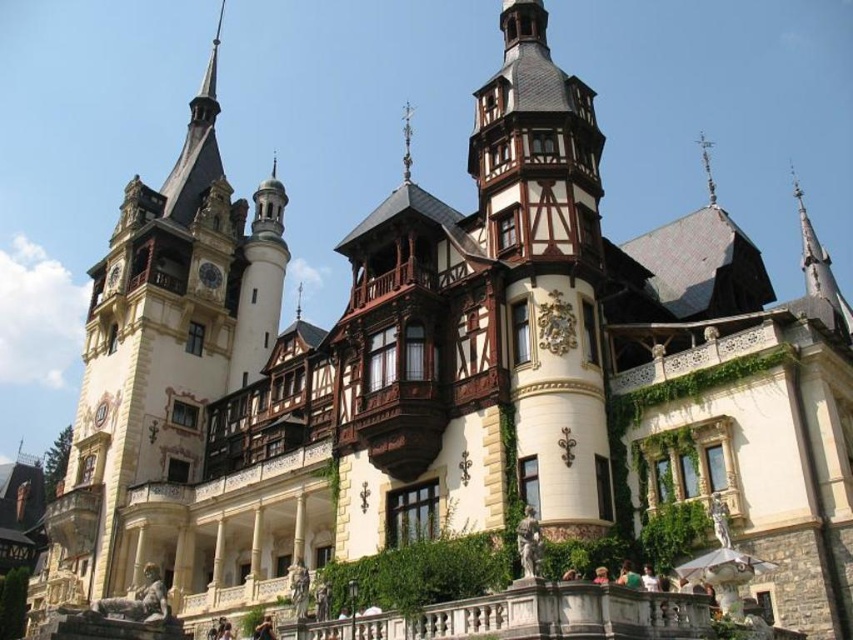
Question: Can you confirm if wooden clock tower at left is wider than matte black clock at upper center?

Choices:
 (A) yes
 (B) no

Answer: (A)

Question: Where is wooden clock tower at left located in relation to matte black clock at upper center in the image?

Choices:
 (A) left
 (B) right

Answer: (A)

Question: Which point is closer to the camera?

Choices:
 (A) (164, 381)
 (B) (210, 260)

Answer: (A)

Question: Does wooden clock tower at left come behind matte black clock at upper center?

Choices:
 (A) no
 (B) yes

Answer: (A)